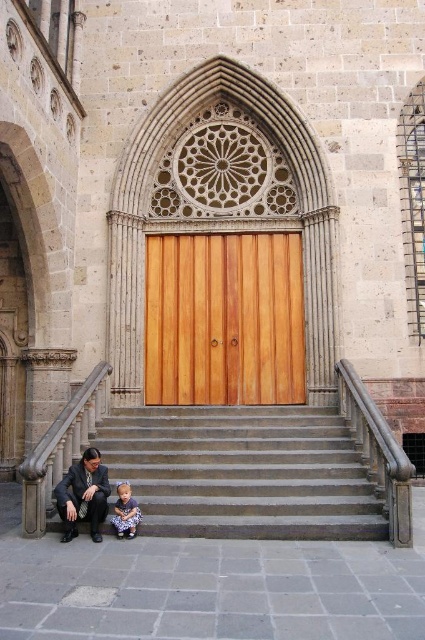
You are standing at the entrance of a grand stone building and see the gray stone stairs at lower center and the matte purple dress at lower left. Which object is positioned to the right of the other?

The gray stone stairs at lower center are to the right of the matte purple dress at lower left.

You are a delivery person carrying a heavy box and need to reach the wooden door at center. The gray stone stairs at lower center are in your way. Can you step over the stairs to reach the door without using them?

The gray stone stairs at lower center is larger in size than wooden door at center, so stepping over them might be difficult due to their size. It is advisable to use the stairs to reach the wooden door at center safely.